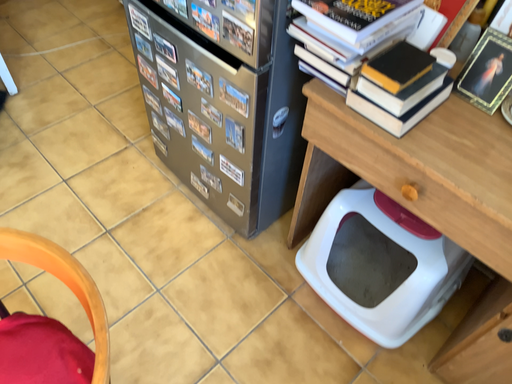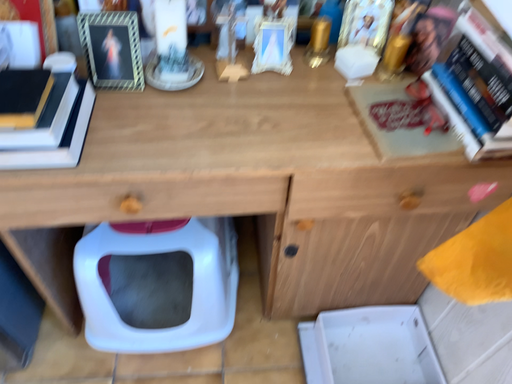
Question: How did the camera likely rotate when shooting the video?

Choices:
 (A) rotated left
 (B) rotated right

Answer: (B)